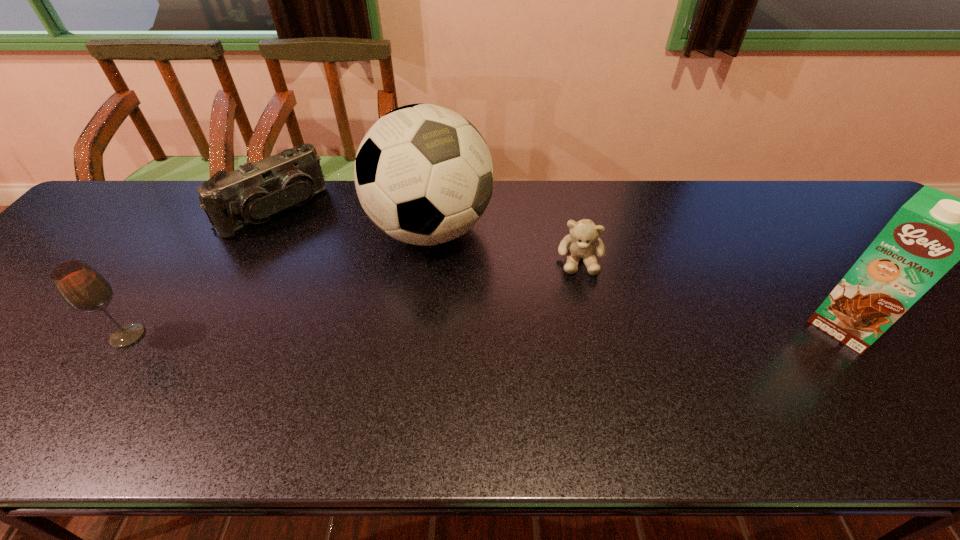
This screenshot has height=540, width=960. Identify the location of free space located 0.130m on the main logo of the soccer ball. (489, 300).

Find the location of a particular element. Image resolution: width=960 pixels, height=540 pixels. vacant space located on the front-facing side of the camcorder is located at coordinates (x=308, y=243).

You are a GUI agent. You are given a task and a screenshot of the screen. Output one action in this format:
    pyautogui.click(x=<x>, y=<y>)
    Task: Click on the vacant region located 0.210m on the front-facing side of the camcorder
    This screenshot has height=540, width=960.
    Given the screenshot: What is the action you would take?
    pyautogui.click(x=338, y=272)

Find the location of `vacant region located on the front-facing side of the camcorder`. vacant region located on the front-facing side of the camcorder is located at coordinates (352, 286).

You are a GUI agent. You are given a task and a screenshot of the screen. Output one action in this format:
    pyautogui.click(x=<x>, y=<y>)
    Task: Click on the blank area located 0.270m on the face of the teddy bear
    This screenshot has height=540, width=960.
    Given the screenshot: What is the action you would take?
    pyautogui.click(x=583, y=372)

Identify the location of vacant space located on the face of the teddy bear. This screenshot has width=960, height=540. pyautogui.click(x=583, y=398).

This screenshot has height=540, width=960. I want to click on vacant space located 0.060m on the face of the teddy bear, so click(x=581, y=297).

In order to click on soccer ball present at the far edge in this screenshot , I will do `click(423, 173)`.

Locate an element on the screen. camcorder that is at the far edge is located at coordinates (254, 193).

Where is `vacant region at the far edge`? The width and height of the screenshot is (960, 540). vacant region at the far edge is located at coordinates (583, 214).